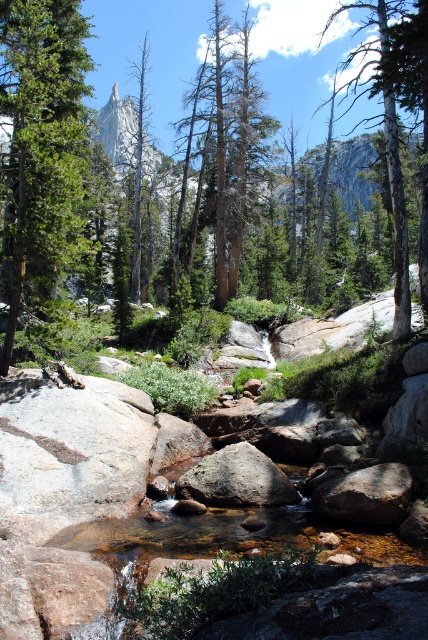
Is green matte tree at left bigger than smooth gray bark tree at right?

No.

Is green matte tree at left thinner than smooth gray bark tree at right?

Yes.

Does point (6, 243) lie in front of point (351, 54)?

Yes, point (6, 243) is in front of point (351, 54).

Identify the location of green matte tree at left. Image resolution: width=428 pixels, height=640 pixels. (41, 147).

Does green matte tree at center appear under green matte tree at left?

No, green matte tree at center is not below green matte tree at left.

What do you see at coordinates (264, 180) in the screenshot? The width and height of the screenshot is (428, 640). I see `green matte tree at center` at bounding box center [264, 180].

This screenshot has height=640, width=428. In order to click on green matte tree at center in this screenshot , I will do `click(264, 180)`.

Is green matte tree at left positioned at the back of green mossy rock at center?

Yes, it is.

Is green matte tree at left below green mossy rock at center?

Incorrect, green matte tree at left is not positioned below green mossy rock at center.

At what (x,y) coordinates should I click in order to perform the action: click on green matte tree at left. Please return your answer as a coordinate pair (x, y). The height and width of the screenshot is (640, 428). Looking at the image, I should click on (41, 147).